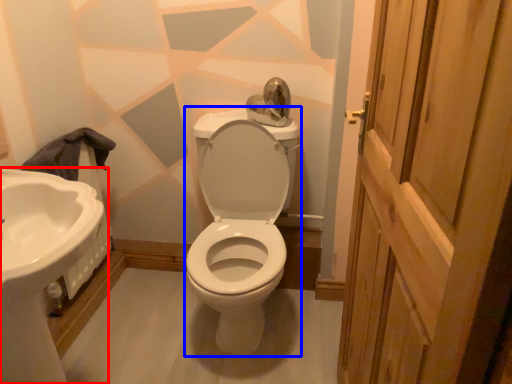
Question: Which point is further to the camera, sink (highlighted by a red box) or porcelain (highlighted by a blue box)?

Choices:
 (A) sink
 (B) porcelain

Answer: (B)